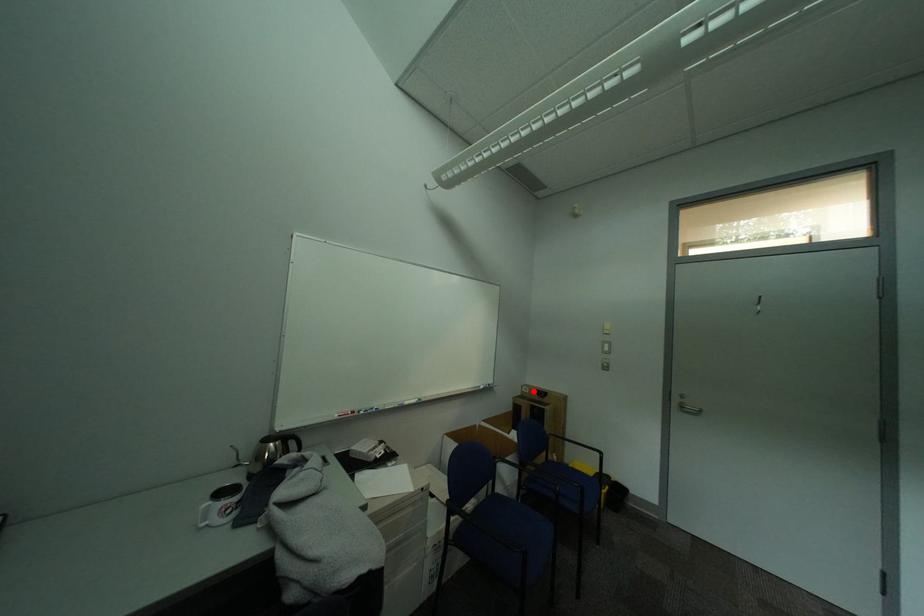
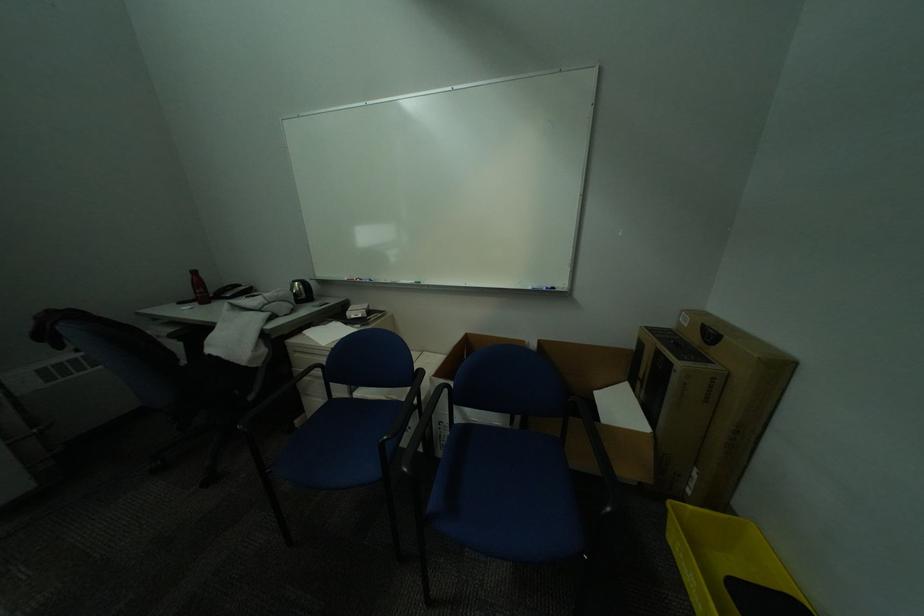
Question: I am providing you with two images of the same scene from different viewpoints. Image1 has a red point marked. In image2, the corresponding 3D location appears at what relative position? Reply with the corresponding letter.

Choices:
 (A) Closer
 (B) Farther

Answer: (A)